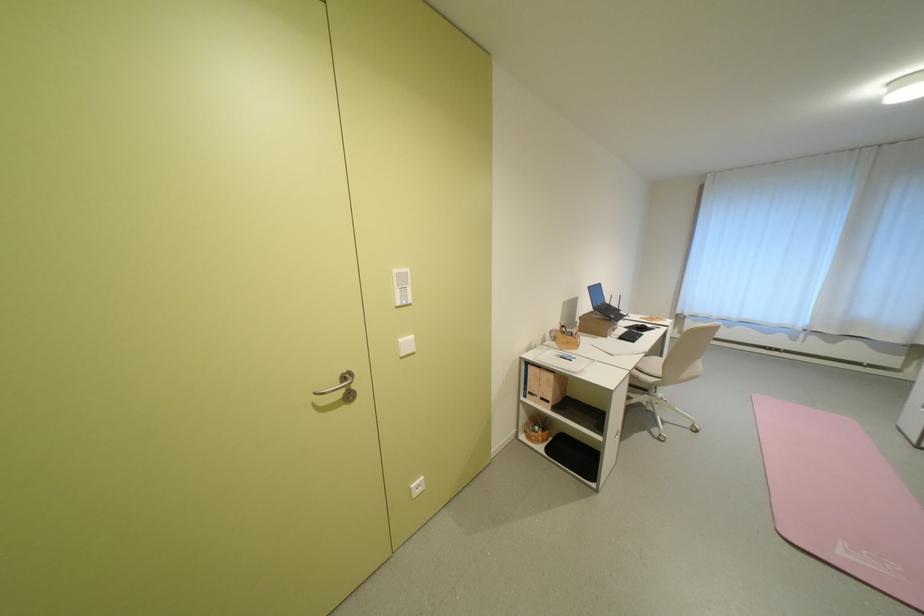
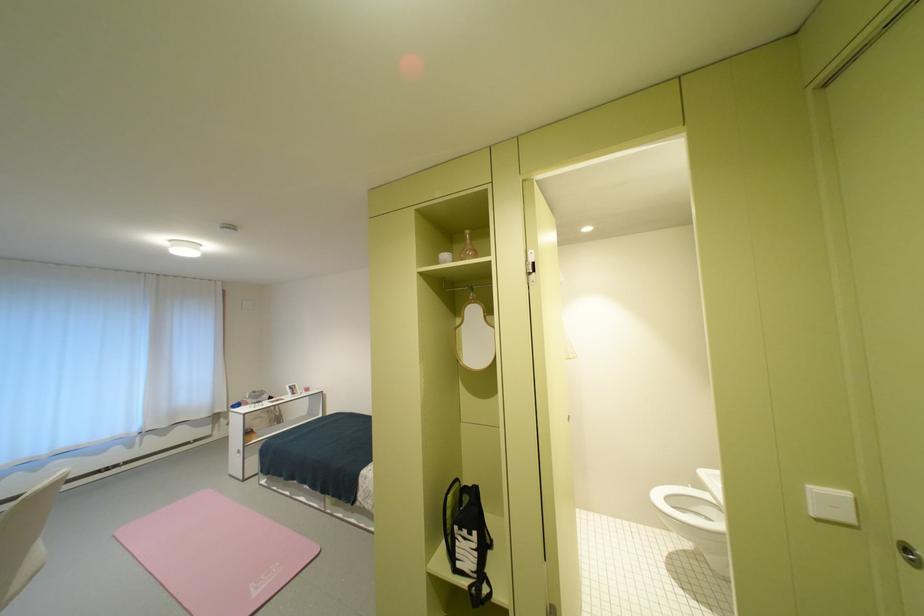
Question: The images are taken continuously from a first-person perspective. In which direction is your viewpoint rotating?

Choices:
 (A) Left
 (B) Right
 (C) Up
 (D) Down

Answer: (B)